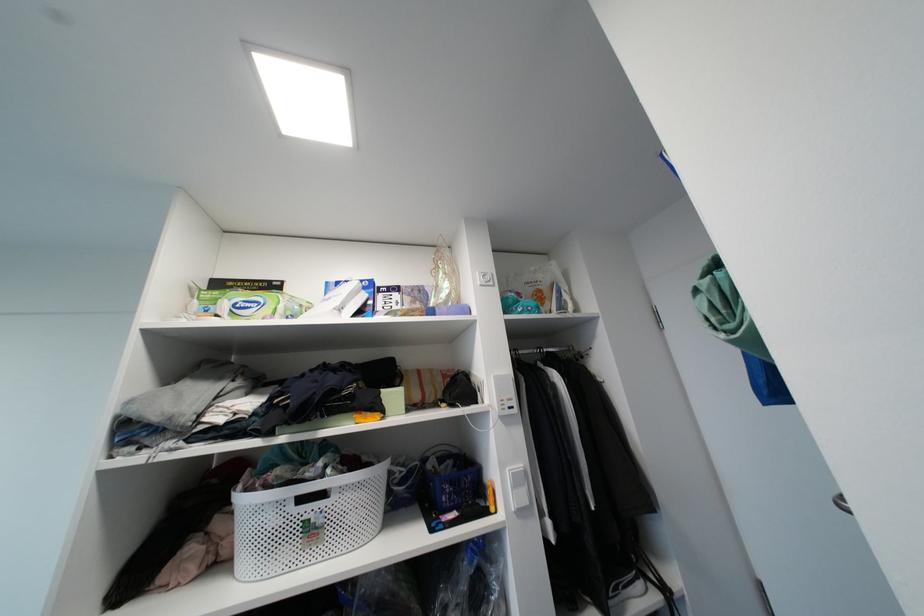
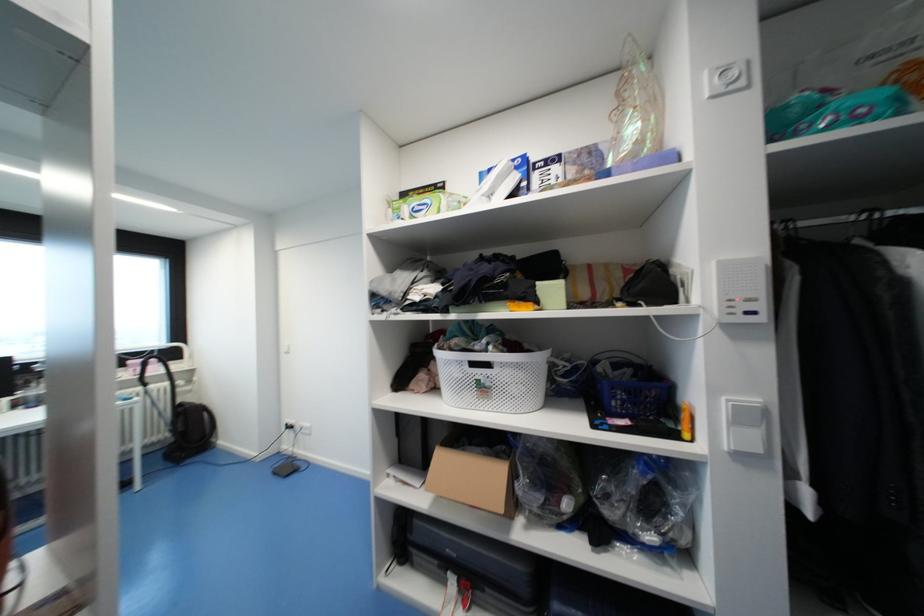
Where in the second image is the point corresponding to [445,460] from the first image?

(621, 367)